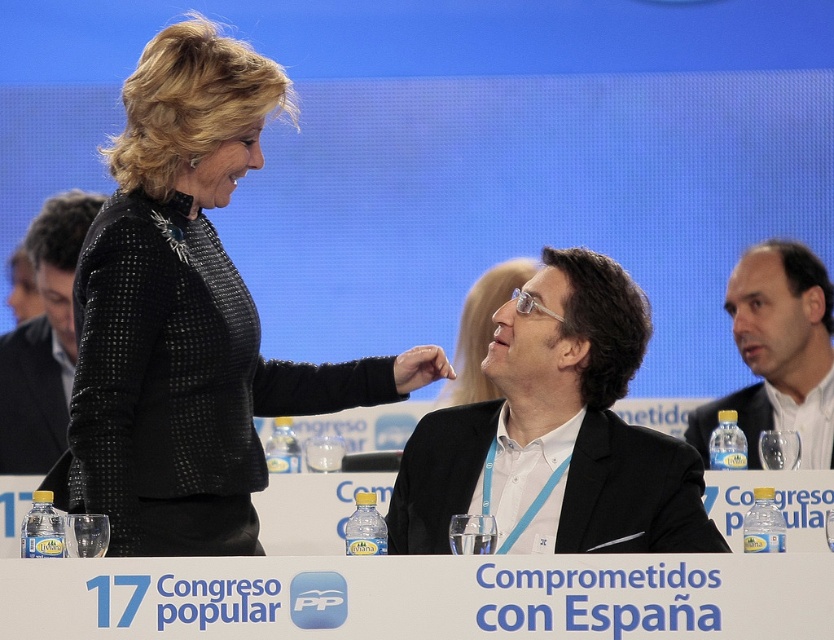
Question: Which of the following is the closest to the observer?

Choices:
 (A) black sequined jacket at upper left
 (B) white shirt at center
 (C) black matte suit at center
 (D) black textured blazer at upper left

Answer: (A)

Question: Which object is farther from the camera taking this photo?

Choices:
 (A) black sequined jacket at upper left
 (B) black textured blazer at upper left
 (C) white shirt at center
 (D) black matte suit at center

Answer: (B)

Question: Is black matte suit at center above black textured blazer at upper left?

Choices:
 (A) yes
 (B) no

Answer: (B)

Question: Does black matte suit at center have a lesser width compared to white shirt at center?

Choices:
 (A) yes
 (B) no

Answer: (A)

Question: Does black sequined jacket at upper left appear on the right side of black textured blazer at upper left?

Choices:
 (A) no
 (B) yes

Answer: (B)

Question: Which of the following is the closest to the observer?

Choices:
 (A) black textured blazer at upper left
 (B) black sequined jacket at upper left
 (C) black matte suit at center
 (D) white shirt at center

Answer: (B)